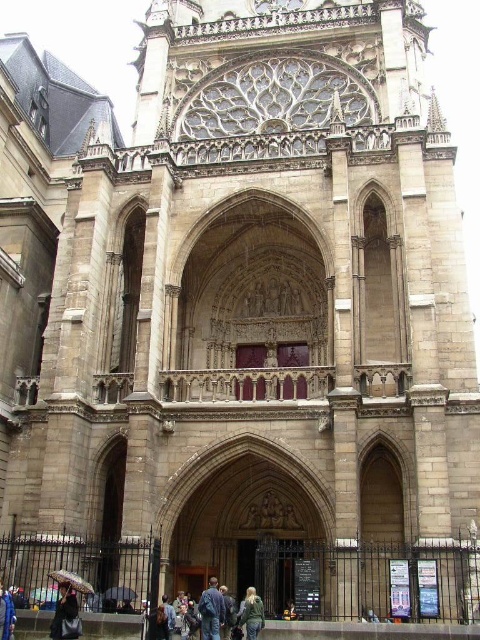
You are standing in front of the cathedral and notice two points marked on the facade. The first point is at coordinates point (55, 616), and the second is at point (21, 593). Which point is closer to your current position?

Point (55, 616) is closer to the camera than point (21, 593), so the first point is closer to your current position.

You are a fashion designer observing the cathedral scene. You notice two jackets in the image. Which jacket has a wider width, the dark brown leather jacket at lower left or the denim jacket at lower center?

The denim jacket at lower center has a wider width than the dark brown leather jacket at lower left.

You are standing in front of the cathedral and notice two items at the lower left corner of the image. Which item is taller between the dark brown leather jacket at lower left and the brown fabric umbrella at lower left?

The dark brown leather jacket at lower left is taller than the brown fabric umbrella at lower left.